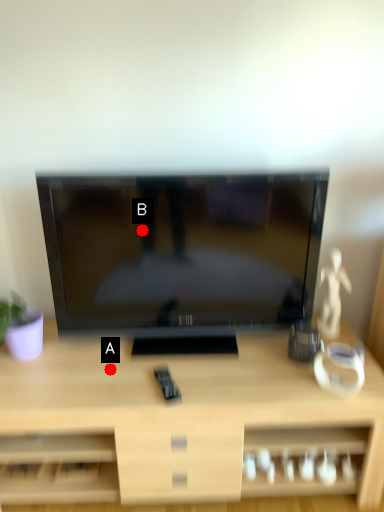
Question: Two points are circled on the image, labeled by A and B beside each circle. Which point is farther to the camera?

Choices:
 (A) A is further
 (B) B is further

Answer: (A)